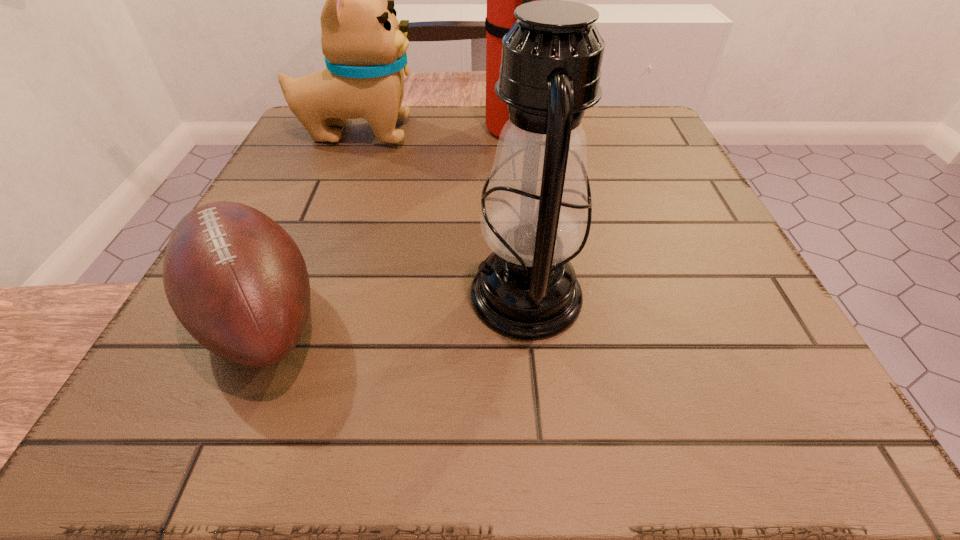
In order to click on vacant point located between the oil lamp and the shortest object in this screenshot , I will do point(394,306).

The height and width of the screenshot is (540, 960). Find the location of `free space between the puppy and the shortest object`. free space between the puppy and the shortest object is located at coordinates (309, 224).

Select which object appears as the closest to the oil lamp. Please provide its 2D coordinates. Your answer should be formatted as a tuple, i.e. [(x, y)], where the tuple contains the x and y coordinates of a point satisfying the conditions above.

[(236, 280)]

Select which object is the third closest to the oil lamp. Please provide its 2D coordinates. Your answer should be formatted as a tuple, i.e. [(x, y)], where the tuple contains the x and y coordinates of a point satisfying the conditions above.

[(364, 45)]

Identify the location of blank space that satisfies the following two spatial constraints: 1. at the nozzle of the fire extinguisher; 2. on the front side of the shortest object. The width and height of the screenshot is (960, 540). (537, 316).

Locate an element on the screen. The width and height of the screenshot is (960, 540). free point that satisfies the following two spatial constraints: 1. on the back side of the oil lamp; 2. on the face of the puppy is located at coordinates (510, 132).

Where is `vacant space that satisfies the following two spatial constraints: 1. on the face of the oil lamp; 2. on the left side of the puppy`? The image size is (960, 540). vacant space that satisfies the following two spatial constraints: 1. on the face of the oil lamp; 2. on the left side of the puppy is located at coordinates (294, 295).

This screenshot has width=960, height=540. I want to click on free space that satisfies the following two spatial constraints: 1. on the face of the puppy; 2. on the front side of the football (American), so click(x=286, y=316).

This screenshot has width=960, height=540. Find the location of `vacant position in the image that satisfies the following two spatial constraints: 1. on the face of the puppy; 2. on the left side of the oil lamp`. vacant position in the image that satisfies the following two spatial constraints: 1. on the face of the puppy; 2. on the left side of the oil lamp is located at coordinates (294, 295).

Identify the location of blank area in the image that satisfies the following two spatial constraints: 1. at the nozzle of the tallest object; 2. on the front side of the shortest object. (537, 316).